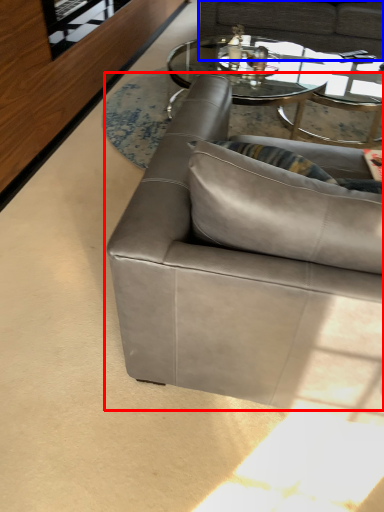
Question: Which object is closer to the camera taking this photo, studio couch (highlighted by a red box) or studio couch (highlighted by a blue box)?

Choices:
 (A) studio couch
 (B) studio couch

Answer: (A)